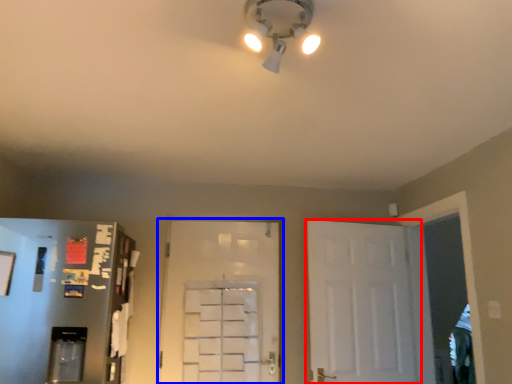
Question: Among these objects, which one is nearest to the camera, door (highlighted by a red box) or door (highlighted by a blue box)?

Choices:
 (A) door
 (B) door

Answer: (A)